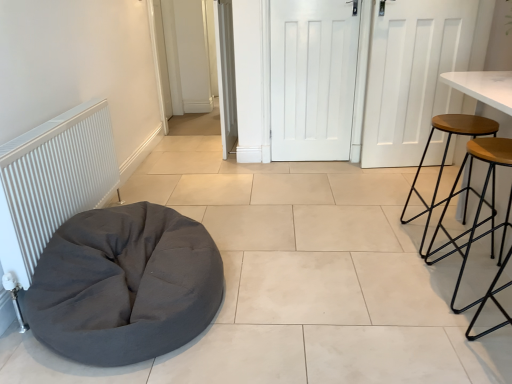
Find the location of a particular element. vacant space that is in between wooden seat stool at right, positioned as the second stool in front-to-back order, and dark gray fabric bean bag at lower left is located at coordinates (323, 273).